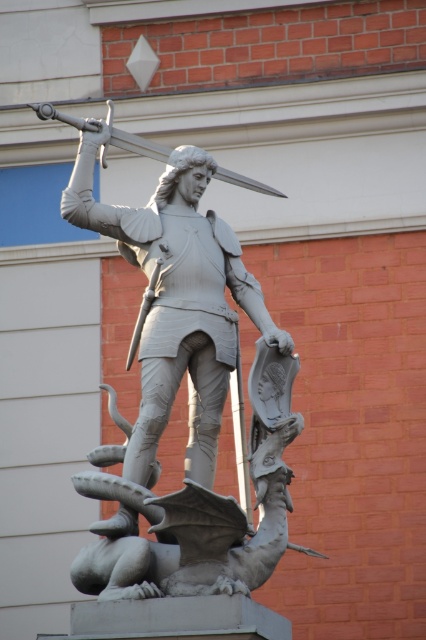
You are an art conservator examining the knight statue and its sword. Based on their positions, can you determine if the polished silver sword at upper center is part of the gray stone statue at center?

The gray stone statue at center is below the polished silver sword at upper center, which indicates that the polished silver sword at upper sword is part of the gray stone statue at center.

You are an architect designing a new museum exhibit. The gray stone statue at center is represented by point [189,390]. If you want to place a spotlight directly above the gray stone statue at center, where should you position it in terms of coordinates?

The gray stone statue at center is represented by point [189,390]. To place a spotlight directly above it, you should position the spotlight at coordinates [189,390] minus the vertical distance needed for the spotlight. However, without specific dimensions, the exact coordinates can be calculated by keeping the x coordinate the same and reducing the y coordinate slightly.

You are an art conservator examining the statue of the knight and dragon. You notice two points on the statue marked at coordinates point (238, 289) and point (138, 138). Which of these points is closer to your viewpoint as you stand in front of the statue?

Point (238, 289) is closer to the camera than point (138, 138), so the point at coordinates point (238, 289) is closer to your viewpoint.